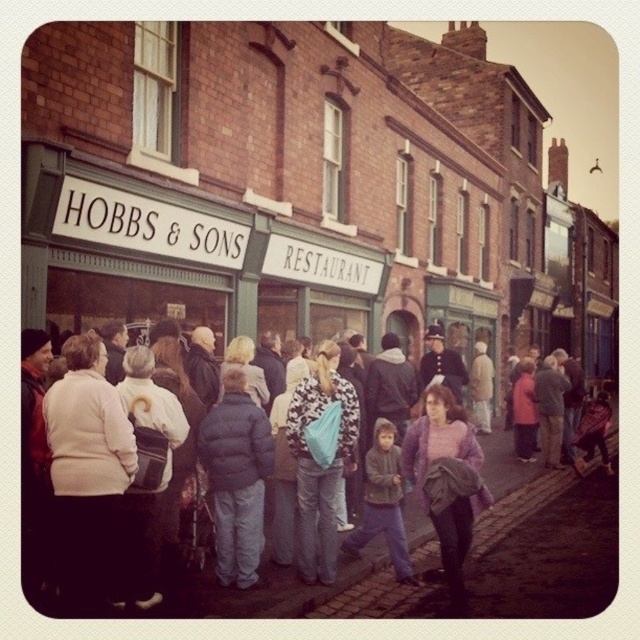
You are a delivery person who needs to quickly pass through the crowd between the dark blue puffer jacket at center and the purple fuzzy sweater at center. Can you navigate through this space if your delivery cart is 3 feet wide?

The distance between the dark blue puffer jacket at center and the purple fuzzy sweater at center is 32.14 feet. Since your delivery cart is only 3 feet wide, there is sufficient space to navigate through the crowd between them.

You are standing at the entrance of the HOBBS and SONS restaurant and want to hand a flyer to the person wearing the matte blue jacket at center. Based on their position, can you estimate whether they are closer to the entrance or further away from it?

The matte blue jacket at center is located at point (512, 497). Since the coordinates are measured from the bottom left corner of the image, a higher y value indicates a position further away from the entrance. Therefore, the person wearing the matte blue jacket at center is further away from the entrance.